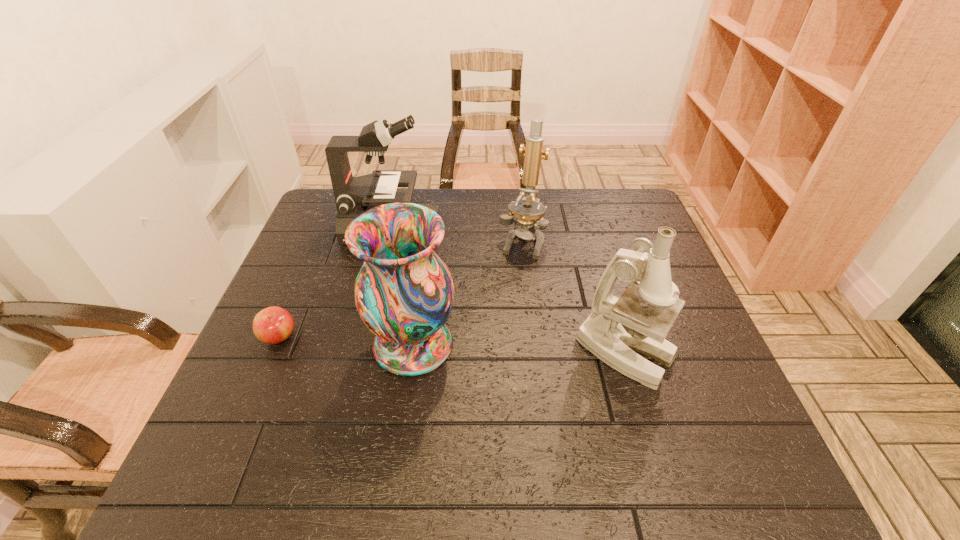
Find the location of `the second microscope from right to left`. the second microscope from right to left is located at coordinates (529, 211).

You are a GUI agent. You are given a task and a screenshot of the screen. Output one action in this format:
    pyautogui.click(x=<x>, y=<y>)
    Task: Click on the leftmost microscope
    
    Given the screenshot: What is the action you would take?
    pyautogui.click(x=353, y=195)

At what (x,y) coordinates should I click in order to perform the action: click on the rightmost object. Please return your answer as a coordinate pair (x, y). Looking at the image, I should click on (617, 326).

Locate an element on the screen. The width and height of the screenshot is (960, 540). the nearest microscope is located at coordinates click(617, 326).

The height and width of the screenshot is (540, 960). I want to click on vase, so click(404, 293).

Locate an element on the screen. The image size is (960, 540). apple is located at coordinates (272, 325).

This screenshot has height=540, width=960. Find the location of `the shortest object`. the shortest object is located at coordinates (272, 325).

The width and height of the screenshot is (960, 540). In order to click on vacant space positioned on the front of the fourth object from left to right in this screenshot , I will do `click(531, 320)`.

You are a GUI agent. You are given a task and a screenshot of the screen. Output one action in this format:
    pyautogui.click(x=<x>, y=<y>)
    Task: Click on the vacant space located 0.130m through the eyepieces of the leftmost microscope
    This screenshot has width=960, height=540.
    Given the screenshot: What is the action you would take?
    pyautogui.click(x=481, y=228)

The width and height of the screenshot is (960, 540). I want to click on vacant space located on the back of the rightmost microscope, so click(607, 292).